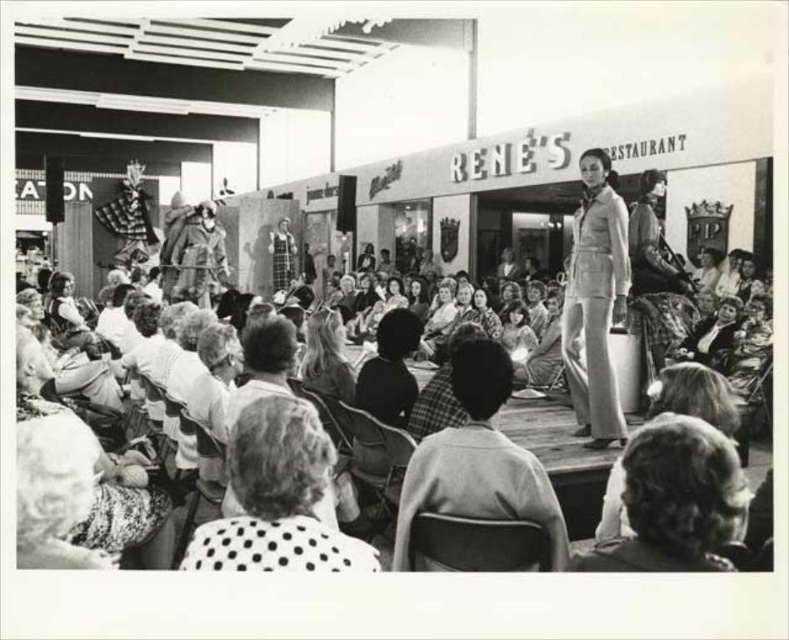
Does polka dot fabric at lower center appear on the right side of dark hair at center?

Incorrect, polka dot fabric at lower center is not on the right side of dark hair at center.

Does polka dot fabric at lower center appear over dark hair at center?

No.

Between point (301, 532) and point (369, 394), which one is positioned behind?

The point (369, 394) is more distant.

The height and width of the screenshot is (640, 789). What are the coordinates of `polka dot fabric at lower center` in the screenshot? It's located at (277, 497).

Which is more to the right, curly hair at center or light beige fabric suit at center?

light beige fabric suit at center

Does curly hair at center have a lesser height compared to light beige fabric suit at center?

Correct, curly hair at center is not as tall as light beige fabric suit at center.

Is point (634, 472) in front of point (606, 273)?

Yes, it is in front of point (606, 273).

The image size is (789, 640). Identify the location of curly hair at center. (675, 500).

Looking at this image, is light beige fabric suit at center bigger than white textured hair at lower left?

Yes.

Is light beige fabric suit at center positioned behind white textured hair at lower left?

Yes, it is.

This screenshot has height=640, width=789. What do you see at coordinates (595, 301) in the screenshot? I see `light beige fabric suit at center` at bounding box center [595, 301].

You are a GUI agent. You are given a task and a screenshot of the screen. Output one action in this format:
    pyautogui.click(x=<x>, y=<y>)
    Task: Click on the light beige fabric suit at center
    
    Given the screenshot: What is the action you would take?
    pyautogui.click(x=595, y=301)